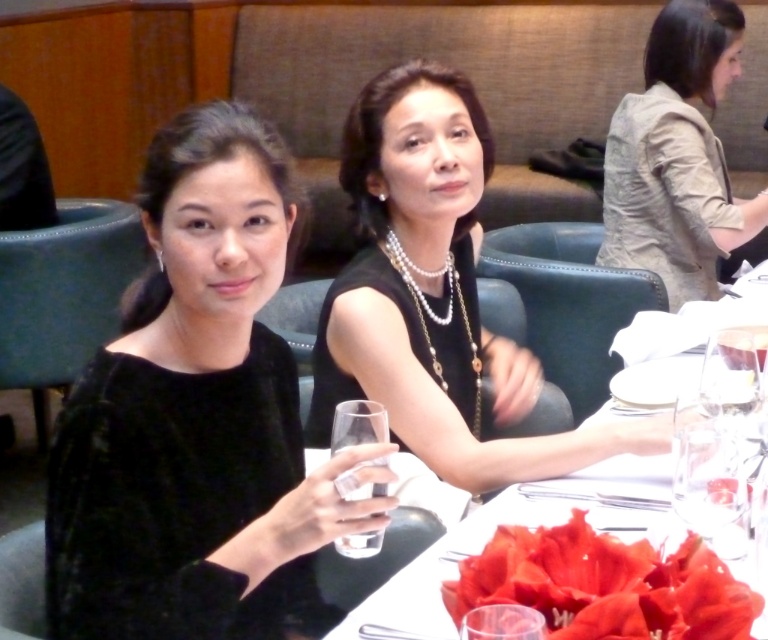
Describe the element at coordinates (677, 156) in the screenshot. I see `beige textured blazer at upper right` at that location.

Is beige textured blazer at upper right to the left of transparent glass at center from the viewer's perspective?

Incorrect, beige textured blazer at upper right is not on the left side of transparent glass at center.

Between point (684, 81) and point (492, 624), which one is positioned behind?

Point (684, 81)

Locate an element on the screen. beige textured blazer at upper right is located at coordinates (677, 156).

Who is more distant from viewer, (502, 372) or (631, 93)?

Point (631, 93)

Describe the element at coordinates (434, 296) in the screenshot. I see `black velvet dress at center` at that location.

This screenshot has height=640, width=768. Find the location of `black velvet dress at center`. black velvet dress at center is located at coordinates (434, 296).

Does clear glass at center have a smaller size compared to transparent glass at center?

Incorrect, clear glass at center is not smaller in size than transparent glass at center.

Is point (346, 550) less distant than point (485, 637)?

That is False.

Does point (359, 422) lie behind point (502, 632)?

Yes.

This screenshot has height=640, width=768. I want to click on clear glass at center, so click(358, 424).